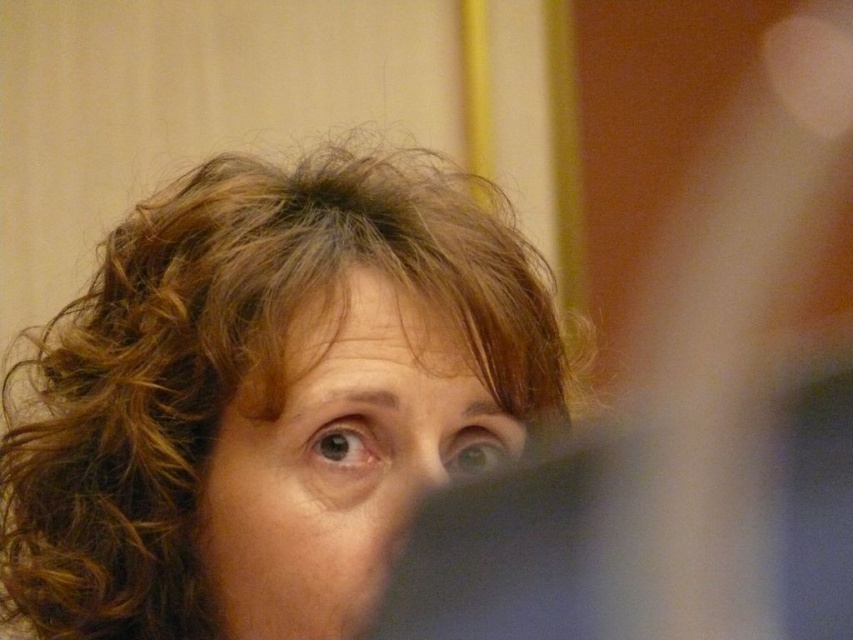
You are a photographer adjusting the focus on a camera. You notice the curly brown hair at upper center and the smooth skin face at center in your viewfinder. Which object should you focus on first if you want to ensure the closer subject is sharp?

The curly brown hair at upper center is closer to the viewer than the smooth skin face at center, so you should focus on the curly brown hair at upper center first to ensure the closer subject is sharp.